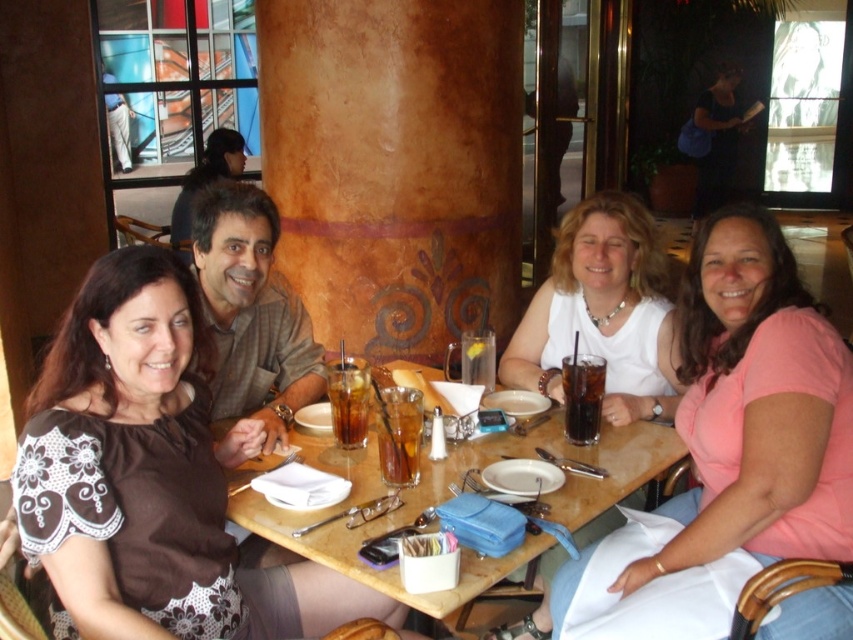
You are a waiter in a restaurant and need to place a new order of drinks on the table. However, you notice the white matte shirt at center and the wooden table at center. Where should you place the drinks to avoid spilling on the shirt?

The white matte shirt at center is above the wooden table at center, so placing the drinks on the wooden table at center below the shirt would avoid spilling on the shirt.

You are a photographer setting up for a group photo. You need to ensure that the brown fabric shirt at upper left and the wooden table at center are both in focus. Given that the camera can only focus on objects within a 1.5 meter height range, can both objects be in focus simultaneously?

The brown fabric shirt at upper left is bigger than the wooden table at center, but this size difference doesn t indicate their height. Without specific height measurements, it s impossible to determine if they re within the 1.5 meter focus range.